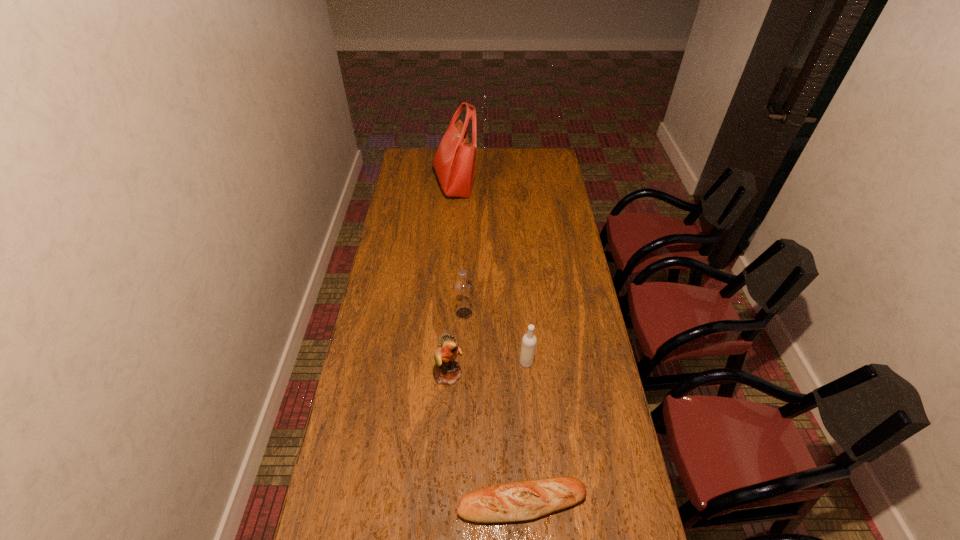
Where is `handbag`? The height and width of the screenshot is (540, 960). handbag is located at coordinates (455, 160).

Where is `the farthest object`? The image size is (960, 540). the farthest object is located at coordinates (455, 160).

This screenshot has width=960, height=540. Find the location of `parrot`. parrot is located at coordinates (448, 372).

Find the location of `the fourth nearest object`. the fourth nearest object is located at coordinates click(x=463, y=288).

Locate an element on the screen. the left vodka is located at coordinates (463, 288).

Locate an element on the screen. This screenshot has height=540, width=960. the nearer vodka is located at coordinates (528, 346).

Find the location of `the nearest object`. the nearest object is located at coordinates (523, 500).

This screenshot has height=540, width=960. Find the location of `baguet`. baguet is located at coordinates (523, 500).

Where is `free space located 0.360m on the front-facing side of the handbag`? This screenshot has height=540, width=960. free space located 0.360m on the front-facing side of the handbag is located at coordinates (543, 184).

In order to click on vacant region located on the front-facing side of the parrot in this screenshot , I will do `click(478, 374)`.